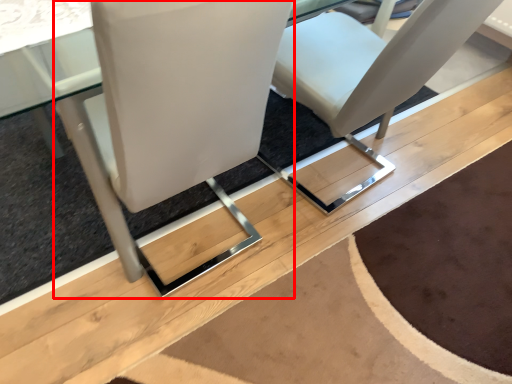
Question: Considering the relative positions of chair (annotated by the red box) and chair in the image provided, where is chair (annotated by the red box) located with respect to the staircase?

Choices:
 (A) right
 (B) left

Answer: (B)